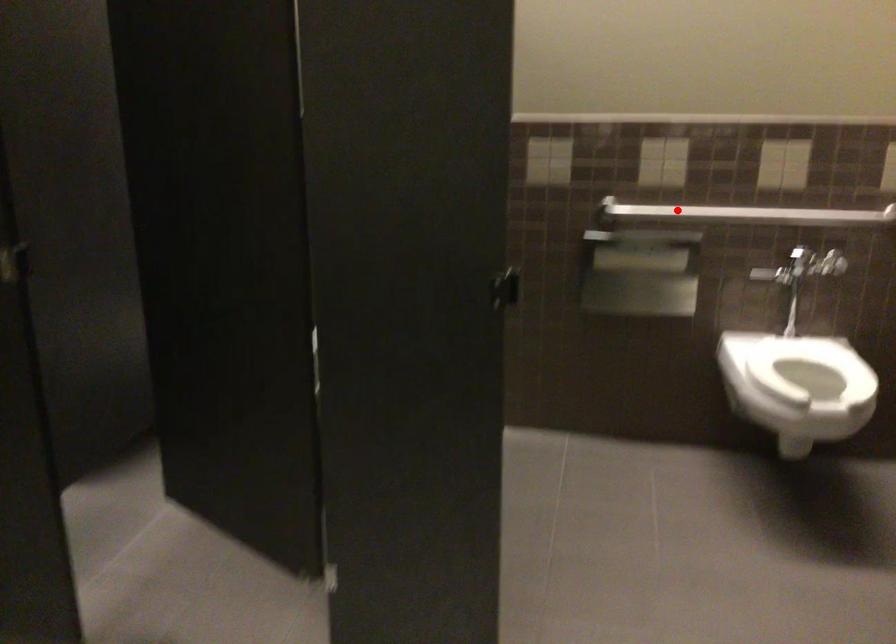
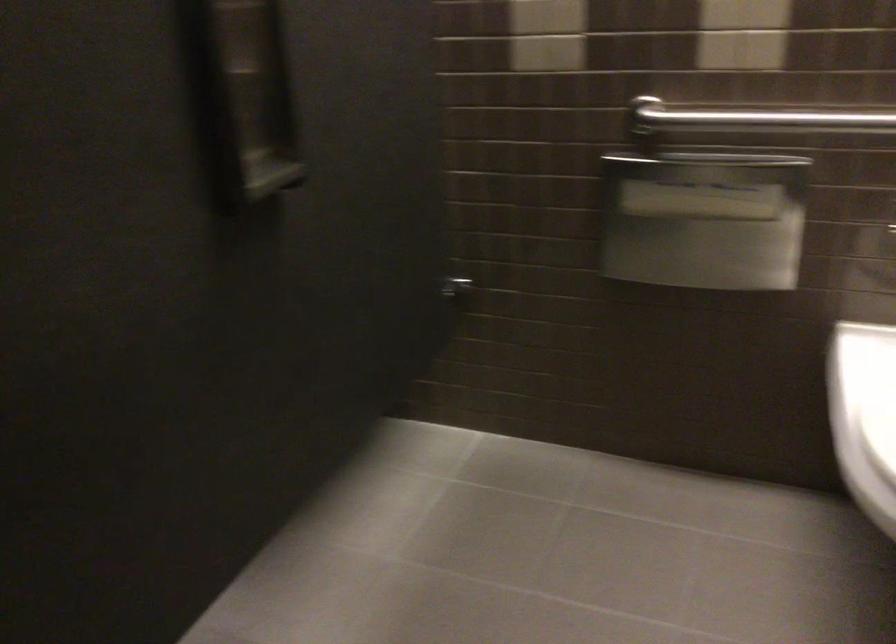
Where in the second image is the point corresponding to the highlighted location from the first image?

(751, 116)